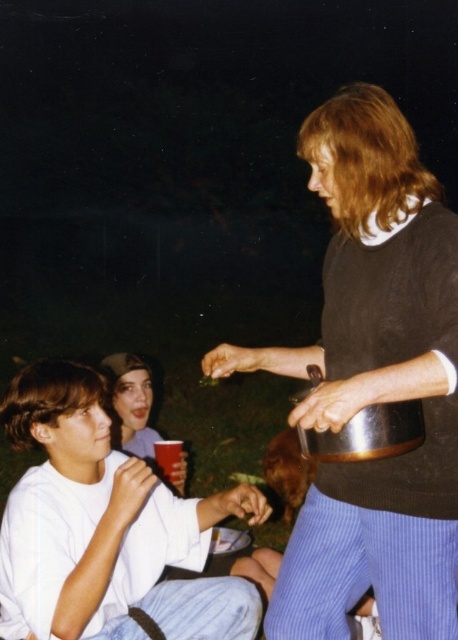
Question: Among these objects, which one is nearest to the camera?

Choices:
 (A) smooth plastic cup at lower left
 (B) translucent plastic cup at lower center

Answer: (A)

Question: Which object is positioned closest to the translucent plastic cup at lower center?

Choices:
 (A) matte black sweater at center
 (B) smooth plastic cup at lower left

Answer: (B)

Question: Can you confirm if white matte shirt at lower left is thinner than smooth plastic cup at lower left?

Choices:
 (A) no
 (B) yes

Answer: (A)

Question: From the image, what is the correct spatial relationship of matte black sweater at center in relation to white matte shirt at lower left?

Choices:
 (A) below
 (B) above

Answer: (B)

Question: Which point is farther to the camera?

Choices:
 (A) (129, 451)
 (B) (158, 451)
 (C) (334, 100)

Answer: (A)

Question: Does matte black sweater at center have a greater width compared to translucent plastic cup at lower center?

Choices:
 (A) no
 (B) yes

Answer: (B)